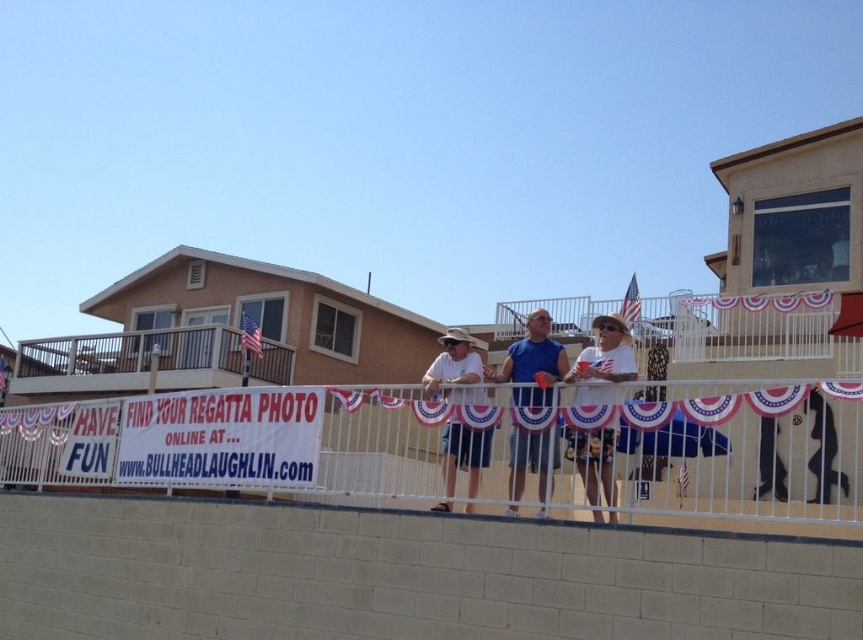
Question: Based on their relative distances, which object is farther from the blue cotton shirt at center?

Choices:
 (A) matte white hat at center
 (B) white cotton shirt at center
 (C) black matte surfboard at center
 (D) white metal fence at center

Answer: (C)

Question: Is the position of white cotton shirt at center more distant than that of black matte surfboard at center?

Choices:
 (A) no
 (B) yes

Answer: (A)

Question: Which of the following is the closest to the observer?

Choices:
 (A) black matte surfboard at center
 (B) white metal fence at center
 (C) white cotton shirt at center
 (D) blue cotton shirt at center

Answer: (B)

Question: Where is blue cotton shirt at center located in relation to black matte surfboard at center in the image?

Choices:
 (A) above
 (B) below

Answer: (A)

Question: Estimate the real-world distances between objects in this image. Which object is farther from the black matte surfboard at center?

Choices:
 (A) matte white hat at center
 (B) blue cotton shirt at center
 (C) white painted wood at upper left

Answer: (C)

Question: Considering the relative positions of white painted wood at upper left and black matte surfboard at center in the image provided, where is white painted wood at upper left located with respect to black matte surfboard at center?

Choices:
 (A) below
 (B) above

Answer: (B)